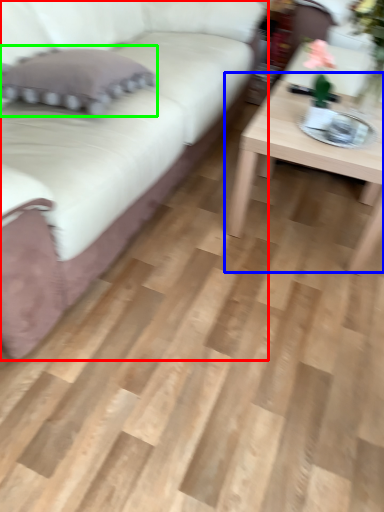
Question: Which object is the farthest from studio couch (highlighted by a red box)? Choose among these: coffee table (highlighted by a blue box) or pillow (highlighted by a green box).

Choices:
 (A) coffee table
 (B) pillow

Answer: (A)